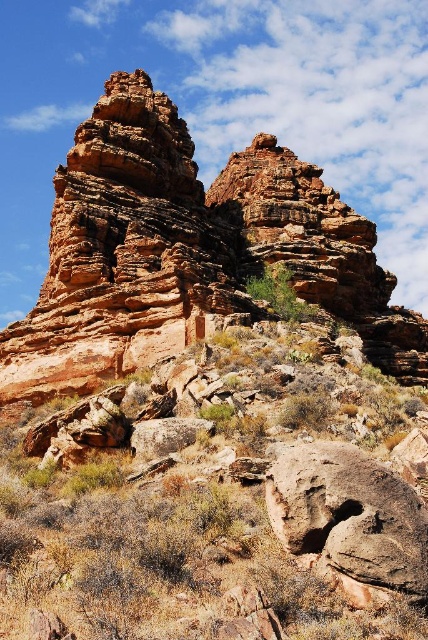
You are a geologist planning to hike between the rustic sandstone rock formation at center and the rusty rock at lower right. Given that your GPS device has a maximum range of 150 feet, will the device track your location accurately throughout the hike?

The distance between the rustic sandstone rock formation at center and the rusty rock at lower right is 151.26 feet, which exceeds the GPS device maximum range of 150 feet. Therefore, the GPS device will not track your location accurately throughout the hike.

You are a geologist examining the landscape. You notice the rustic sandstone rock formation at center and the rusty rock at lower right. Which rock is located higher up in the scene?

The rustic sandstone rock formation at center is positioned over the rusty rock at lower right, so it is higher up in the scene.